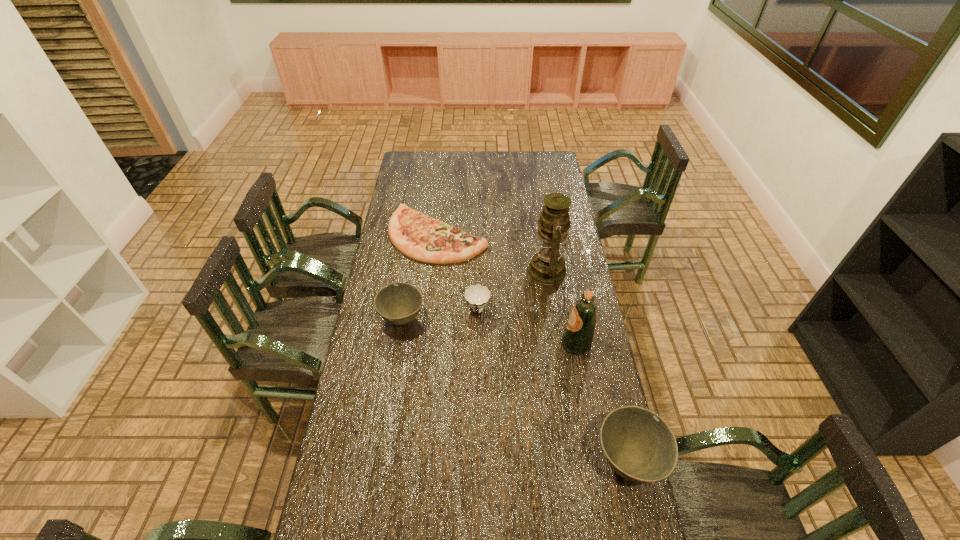
Where is `the left bowl`? Image resolution: width=960 pixels, height=540 pixels. the left bowl is located at coordinates (398, 303).

Identify the location of the third shortest object. (398, 303).

In order to click on the right bowl in this screenshot , I will do `click(638, 445)`.

Locate an element on the screen. The image size is (960, 540). the taller bowl is located at coordinates (638, 445).

The width and height of the screenshot is (960, 540). I want to click on oil lamp, so click(547, 266).

At what (x,y) coordinates should I click in order to perform the action: click on the shortest object. Please return your answer as a coordinate pair (x, y). Looking at the image, I should click on (422, 238).

Locate an element on the screen. the fifth tallest object is located at coordinates (477, 296).

This screenshot has height=540, width=960. Identify the location of olive oil. (578, 336).

Identify the location of free location located 0.150m on the right of the farther bowl. The height and width of the screenshot is (540, 960). (463, 319).

What are the coordinates of `free region located on the left of the nearest object` in the screenshot? It's located at pos(516,461).